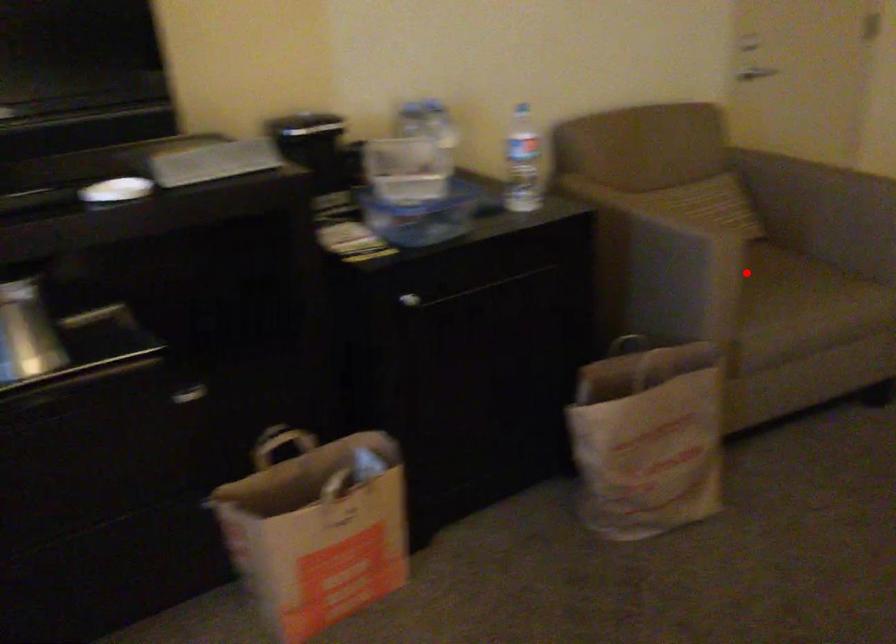
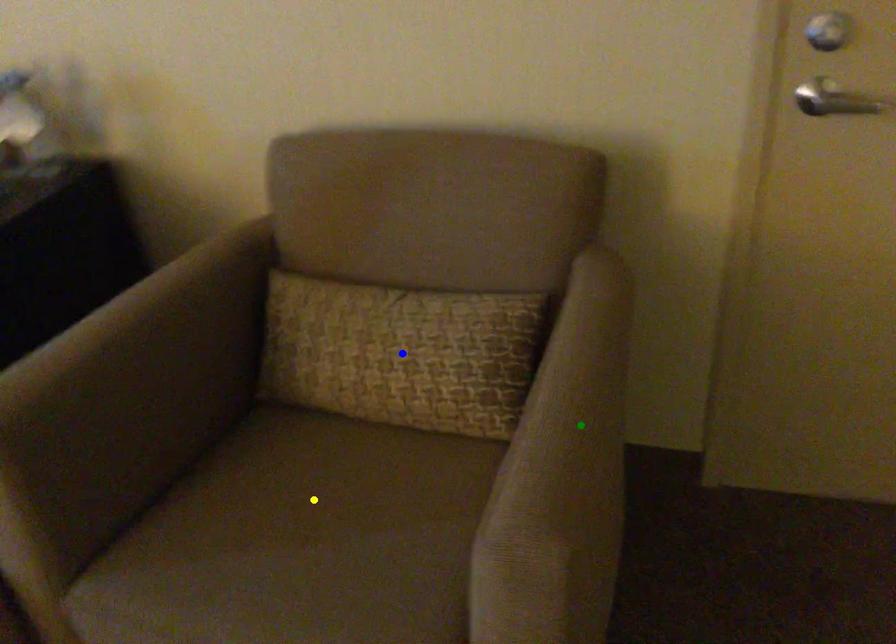
Question: I am providing you with two images of the same scene from different viewpoints. A red point is marked on the first image. You are given multiple points on the second image. Which spot in image 2 lines up with the point in image 1?

Choices:
 (A) green point
 (B) blue point
 (C) yellow point

Answer: (C)